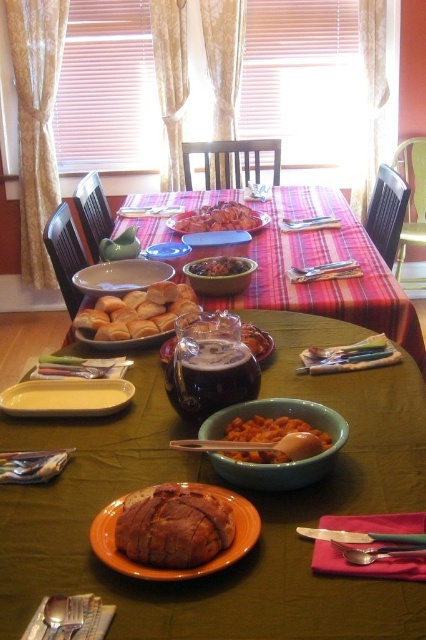
Does orange glazed bread at center come behind matte blue plate at center?

That is False.

Can you confirm if orange glazed bread at center is smaller than matte blue plate at center?

Indeed, orange glazed bread at center has a smaller size compared to matte blue plate at center.

Which is in front, point (250, 424) or point (180, 252)?

Positioned in front is point (250, 424).

What are the coordinates of `orange glazed bread at center` in the screenshot? It's located at (270, 429).

Does orange matte plate at center have a greater width compared to orange glazed bread at center?

Yes, orange matte plate at center is wider than orange glazed bread at center.

Consider the image. Does orange matte plate at center appear over orange glazed bread at center?

Incorrect, orange matte plate at center is not positioned above orange glazed bread at center.

Who is more forward, [97,541] or [325,435]?

Point [97,541] is more forward.

The height and width of the screenshot is (640, 426). Identify the location of orange matte plate at center. [176, 570].

Is satin silver fork at lower left positioned behind matte blue plate at center?

No.

Does satin silver fork at lower left have a smaller size compared to matte blue plate at center?

Yes, satin silver fork at lower left is smaller than matte blue plate at center.

Identify the location of satin silver fork at lower left. The width and height of the screenshot is (426, 640). (63, 616).